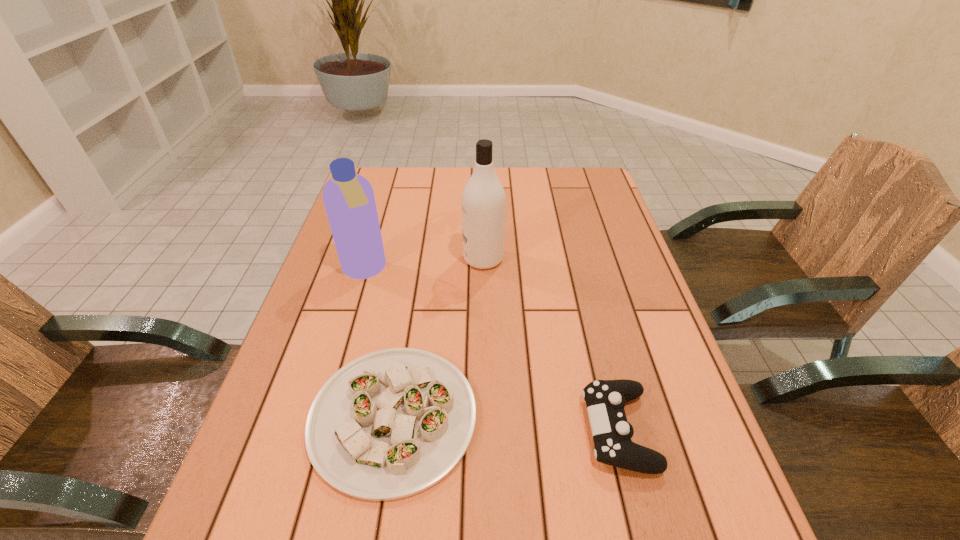
Identify the location of blank area located 0.400m on the surface of the third tallest object. Image resolution: width=960 pixels, height=540 pixels. (374, 429).

This screenshot has height=540, width=960. Identify the location of free space located 0.360m on the surface of the third tallest object. (396, 429).

At what (x,y) coordinates should I click in order to perform the action: click on free space located 0.240m on the right of the platter. Please return your answer as a coordinate pair (x, y). The image size is (960, 540). Looking at the image, I should click on (600, 417).

I want to click on shampoo at the left edge, so click(x=348, y=197).

Where is `platter that is at the left edge`? Image resolution: width=960 pixels, height=540 pixels. platter that is at the left edge is located at coordinates (390, 424).

The image size is (960, 540). I want to click on object that is at the right edge, so click(605, 399).

Where is `vacant space at the left edge`? This screenshot has width=960, height=540. vacant space at the left edge is located at coordinates (356, 303).

Image resolution: width=960 pixels, height=540 pixels. In order to click on vacant area at the right edge of the desktop in this screenshot , I will do `click(569, 224)`.

The image size is (960, 540). I want to click on free region at the far left corner of the desktop, so click(x=376, y=188).

Where is `unoccupied position between the shortest object and the left shampoo`? unoccupied position between the shortest object and the left shampoo is located at coordinates (378, 343).